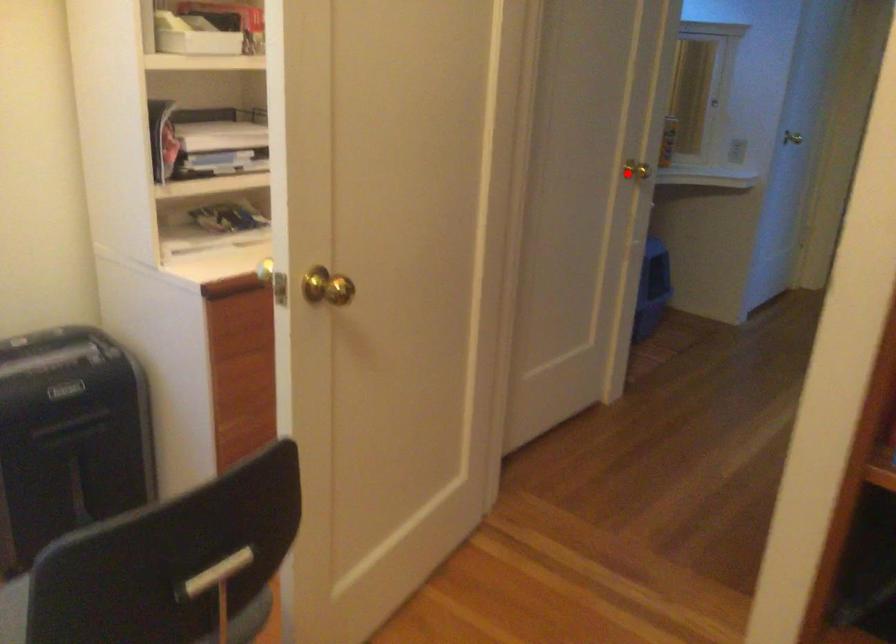
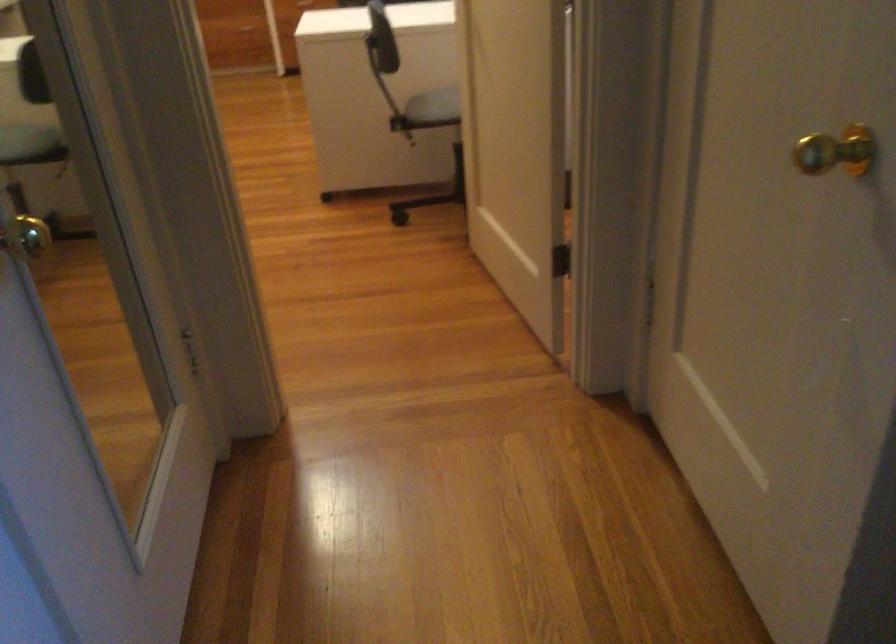
In the second image, find the point that corresponds to the highlighted location in the first image.

(836, 152)